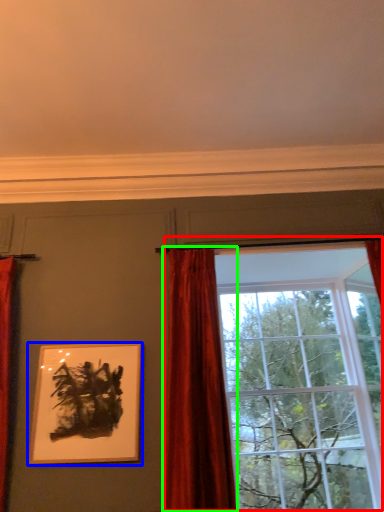
Question: Based on their relative distances, which object is farther from window (highlighted by a red box)? Choose from picture frame (highlighted by a blue box) and curtain (highlighted by a green box).

Choices:
 (A) picture frame
 (B) curtain

Answer: (A)